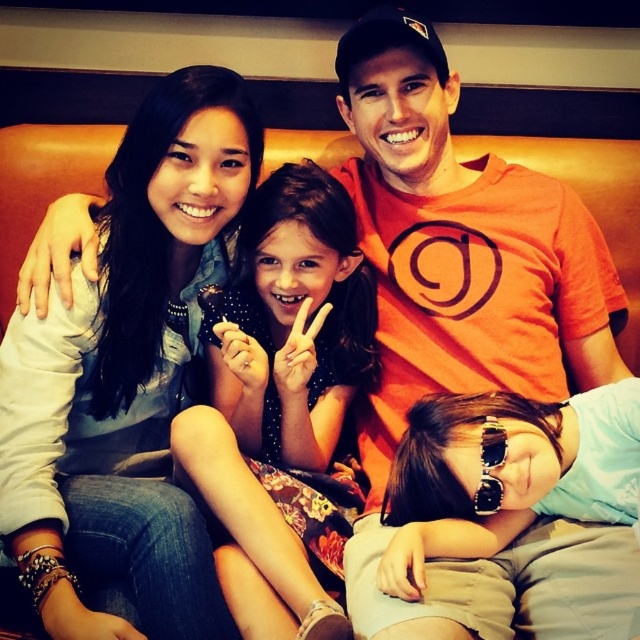
Question: Which point appears closest to the camera in this image?

Choices:
 (A) (180, 346)
 (B) (314, 403)
 (C) (433, 401)

Answer: (C)

Question: Is matte blue scarf at upper left below sunglasses at center?

Choices:
 (A) no
 (B) yes

Answer: (A)

Question: Which object is the closest to the sunglasses at center?

Choices:
 (A) floral dress at center
 (B) matte blue scarf at upper left

Answer: (A)

Question: Does floral dress at center have a larger size compared to sunglasses at center?

Choices:
 (A) yes
 (B) no

Answer: (A)

Question: Which of these objects is positioned closest to the sunglasses at center?

Choices:
 (A) matte blue scarf at upper left
 (B) floral dress at center

Answer: (B)

Question: Does floral dress at center lie behind sunglasses at center?

Choices:
 (A) no
 (B) yes

Answer: (A)